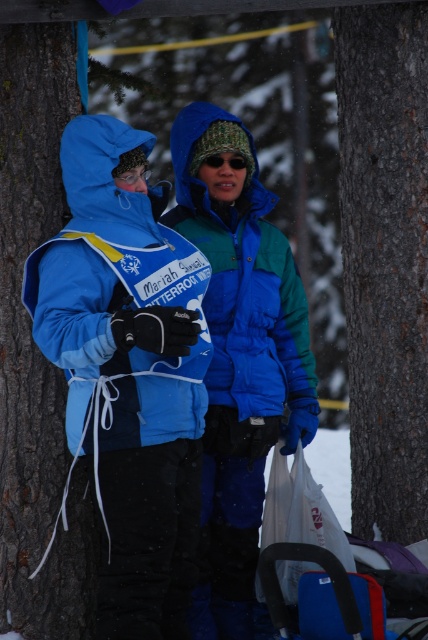
The width and height of the screenshot is (428, 640). Find the location of `brown rough bark at left`. brown rough bark at left is located at coordinates (35, 348).

Consider the image. Which is above, brown rough bark at left or camouflage fabric goggles at center?

camouflage fabric goggles at center

Which is behind, point (23, 326) or point (237, 156)?

The point (237, 156) is more distant.

Identify the location of brown rough bark at left. This screenshot has height=640, width=428. (35, 348).

Based on the photo, can you confirm if brown rough bark at left is smaller than matte black goggles at center?

Incorrect, brown rough bark at left is not smaller in size than matte black goggles at center.

Which is behind, point (0, 134) or point (134, 179)?

Positioned behind is point (0, 134).

Where is `brown rough bark at left`? brown rough bark at left is located at coordinates (35, 348).

Which is above, camouflage fabric goggles at center or matte black goggles at center?

Positioned higher is camouflage fabric goggles at center.

Based on the photo, which is more to the right, camouflage fabric goggles at center or matte black goggles at center?

From the viewer's perspective, camouflage fabric goggles at center appears more on the right side.

Which is in front, point (204, 161) or point (124, 177)?

Positioned in front is point (124, 177).

Where is `camouflage fabric goggles at center`? The width and height of the screenshot is (428, 640). camouflage fabric goggles at center is located at coordinates (228, 161).